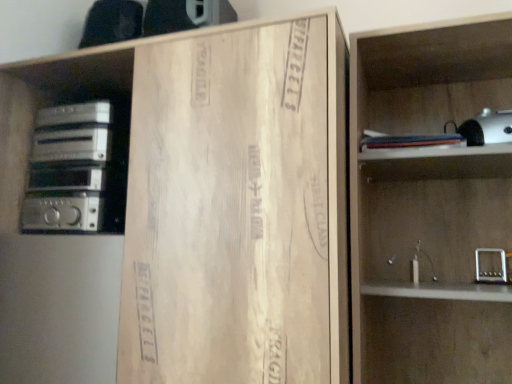
What do you see at coordinates (69, 169) in the screenshot? I see `silver metallic stereo at left` at bounding box center [69, 169].

Find the location of `wooden shelf at right`. wooden shelf at right is located at coordinates (429, 206).

Find the location of a particular element. Image resolution: width=512 pixels, height=384 pixels. silver metallic stereo at left is located at coordinates (69, 169).

Considering the positions of point (233, 293) and point (88, 220), is point (233, 293) closer or farther from the camera than point (88, 220)?

Clearly, point (233, 293) is closer to the camera than point (88, 220).

From a real-world perspective, does wooden cardboard at center sit lower than silver metallic stereo at left?

Yes, from a real-world perspective, wooden cardboard at center is under silver metallic stereo at left.

Which object is positioned more to the right, wooden cardboard at center or silver metallic stereo at left?

wooden cardboard at center.

Is wooden cardboard at center touching silver metallic stereo at left?

They are not placed beside each other.

From a real-world perspective, relative to wooden cardboard at center, is wooden shelf at right vertically above or below?

Clearly, from a real-world perspective, wooden shelf at right is above wooden cardboard at center.

Based on their sizes in the image, would you say wooden shelf at right is bigger or smaller than wooden cardboard at center?

wooden shelf at right is smaller than wooden cardboard at center.

Does point (396, 290) come behind point (246, 217)?

That is True.

Which object is positioned more to the left, wooden shelf at right or wooden cardboard at center?

wooden cardboard at center is more to the left.

Does silver metallic stereo at left have a smaller size compared to wooden shelf at right?

Indeed, silver metallic stereo at left has a smaller size compared to wooden shelf at right.

Between silver metallic stereo at left and wooden shelf at right, which one has larger width?

Wider between the two is wooden shelf at right.

Consider the image. From the image's perspective, which is above, silver metallic stereo at left or wooden shelf at right?

silver metallic stereo at left.

Does point (156, 293) lie behind point (429, 157)?

No, (156, 293) is closer to viewer.

Is wooden cardboard at center further to camera compared to wooden shelf at right?

No.

Image resolution: width=512 pixels, height=384 pixels. What are the coordinates of `shelf that is above the wooden cardboard at center (from a real-world perspective)` in the screenshot? It's located at (429, 206).

Are wooden shelf at right and silver metallic stereo at left far apart?

wooden shelf at right is actually quite close to silver metallic stereo at left.

You are a GUI agent. You are given a task and a screenshot of the screen. Output one action in this format:
    pyautogui.click(x=<x>, y=<y>)
    Task: Click on the stereo behind the wooden shelf at right
    The height and width of the screenshot is (384, 512).
    Given the screenshot: What is the action you would take?
    pyautogui.click(x=69, y=169)

From the image's perspective, is wooden shelf at right positioned above or below silver metallic stereo at left?

wooden shelf at right is situated lower than silver metallic stereo at left in the image.

This screenshot has width=512, height=384. In order to click on cardboard lying on the right of silver metallic stereo at left in this screenshot , I will do `click(237, 207)`.

From a real-world perspective, is silver metallic stereo at left above or below wooden cardboard at center?

silver metallic stereo at left is above wooden cardboard at center.

Is silver metallic stereo at left spatially inside wooden cardboard at center, or outside of it?

silver metallic stereo at left is located inside wooden cardboard at center.

Find the location of a particular element. Image resolution: width=512 pixels, height=384 pixels. cardboard below the silver metallic stereo at left (from a real-world perspective) is located at coordinates (237, 207).

Where is `cardboard that appears below the wooden shelf at right (from the image's perspective)`? Image resolution: width=512 pixels, height=384 pixels. cardboard that appears below the wooden shelf at right (from the image's perspective) is located at coordinates (237, 207).

Based on their spatial positions, is silver metallic stereo at left or wooden shelf at right closer to wooden cardboard at center?

wooden shelf at right is closer to wooden cardboard at center.

Consider the image. Based on their spatial positions, is wooden cardboard at center or wooden shelf at right closer to silver metallic stereo at left?

Among the two, wooden cardboard at center is located nearer to silver metallic stereo at left.

Which object lies further to the anchor point wooden shelf at right, silver metallic stereo at left or wooden cardboard at center?

Among the two, silver metallic stereo at left is located further to wooden shelf at right.

Estimate the real-world distances between objects in this image. Which object is closer to silver metallic stereo at left, wooden shelf at right or wooden cardboard at center?

The object closer to silver metallic stereo at left is wooden cardboard at center.

Based on their spatial positions, is wooden cardboard at center or silver metallic stereo at left closer to wooden shelf at right?

wooden cardboard at center is positioned closer to the anchor wooden shelf at right.

Considering their positions, is wooden shelf at right positioned further to wooden cardboard at center than silver metallic stereo at left?

silver metallic stereo at left.

This screenshot has width=512, height=384. Find the location of `cardboard located between silver metallic stereo at left and wooden shelf at right in the left-right direction`. cardboard located between silver metallic stereo at left and wooden shelf at right in the left-right direction is located at coordinates [237, 207].